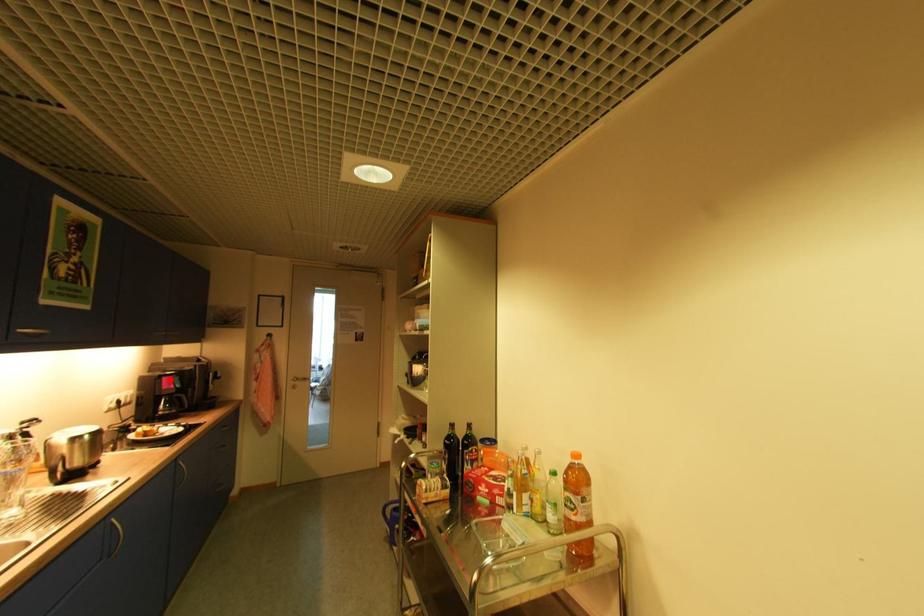
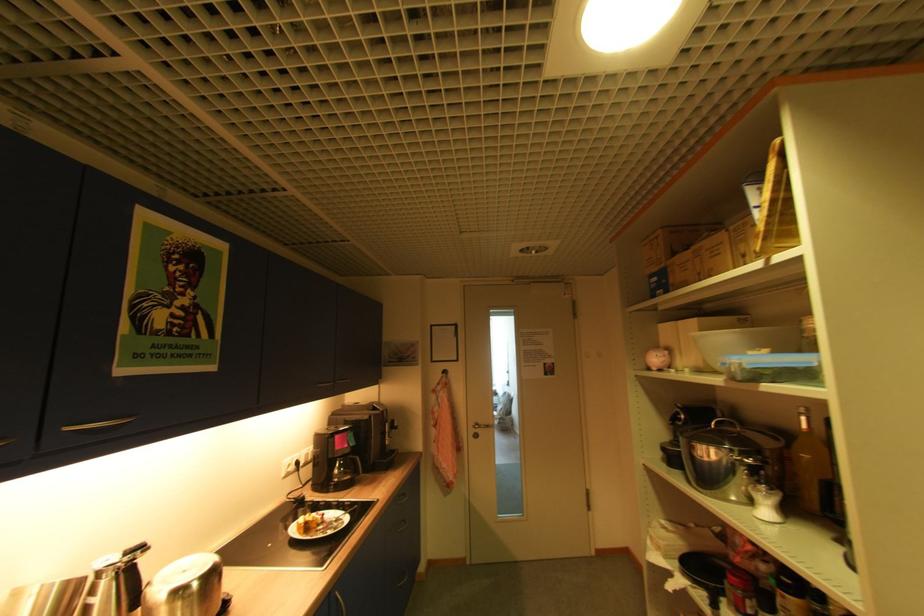
The point at the highlighted location is marked in the first image. Where is the corresponding point in the second image?

(343, 437)